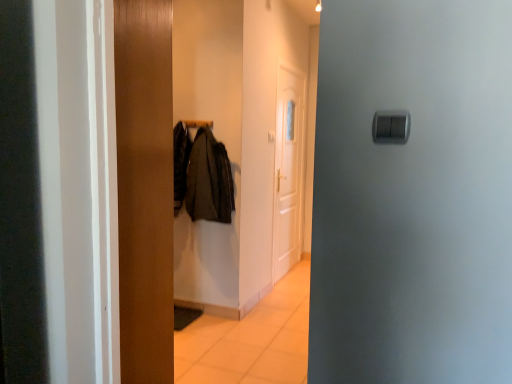
Question: Does metallic coat hanger at center have a lesser height compared to white glossy door at center, which appears as the first door when viewed from the right?

Choices:
 (A) no
 (B) yes

Answer: (B)

Question: Considering the relative sizes of metallic coat hanger at center and white glossy door at center, which appears as the second door when viewed from the front, in the image provided, is metallic coat hanger at center wider than white glossy door at center, which appears as the second door when viewed from the front,?

Choices:
 (A) no
 (B) yes

Answer: (B)

Question: From a real-world perspective, is metallic coat hanger at center physically above white glossy door at center, placed as the second door when sorted from left to right?

Choices:
 (A) yes
 (B) no

Answer: (A)

Question: Is metallic coat hanger at center in contact with white glossy door at center, positioned as the first door in back-to-front order?

Choices:
 (A) no
 (B) yes

Answer: (A)

Question: Can you confirm if metallic coat hanger at center is taller than white glossy door at center, which appears as the first door when viewed from the right?

Choices:
 (A) yes
 (B) no

Answer: (B)

Question: Is metallic coat hanger at center outside white glossy door at center, placed as the second door when sorted from left to right?

Choices:
 (A) no
 (B) yes

Answer: (B)

Question: Is metallic coat hanger at center positioned far away from wooden door at center, which is the 1th door from front to back?

Choices:
 (A) no
 (B) yes

Answer: (B)

Question: Is metallic coat hanger at center positioned before wooden door at center, arranged as the 2th door when viewed from the right?

Choices:
 (A) yes
 (B) no

Answer: (B)

Question: Is metallic coat hanger at center positioned with its back to wooden door at center, arranged as the 2th door when viewed from the right?

Choices:
 (A) no
 (B) yes

Answer: (A)

Question: Could you tell me if metallic coat hanger at center is facing wooden door at center, positioned as the second door in back-to-front order?

Choices:
 (A) no
 (B) yes

Answer: (A)

Question: Would you say metallic coat hanger at center contains wooden door at center, which is the 1th door from front to back?

Choices:
 (A) yes
 (B) no

Answer: (B)

Question: From the image's perspective, would you say metallic coat hanger at center is positioned over wooden door at center, which is the 1th door from front to back?

Choices:
 (A) no
 (B) yes

Answer: (B)

Question: Are dark gray fabric coat at center and wooden door at center, arranged as the 2th door when viewed from the right, beside each other?

Choices:
 (A) yes
 (B) no

Answer: (B)